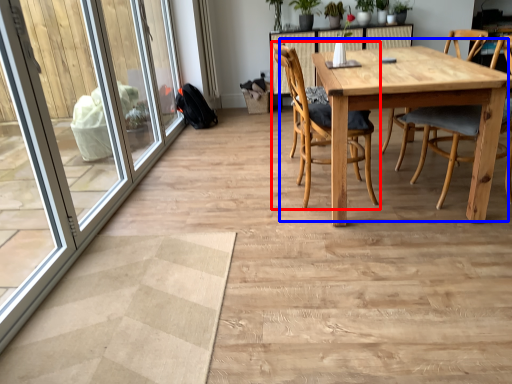
Question: Which of the following is the closest to the observer, chair (highlighted by a red box) or kitchen & dining room table (highlighted by a blue box)?

Choices:
 (A) chair
 (B) kitchen & dining room table

Answer: (B)